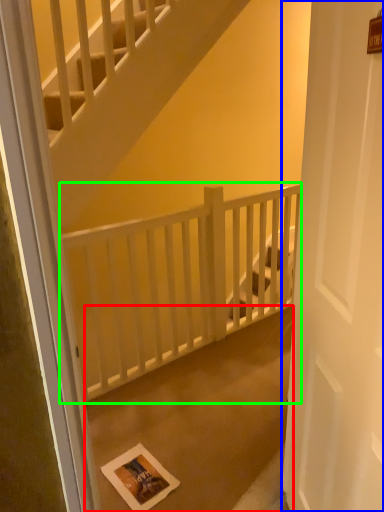
Question: Based on their relative distances, which object is farther from concrete (highlighted by a red box)? Choose from door (highlighted by a blue box) and balustrade (highlighted by a green box).

Choices:
 (A) door
 (B) balustrade

Answer: (A)